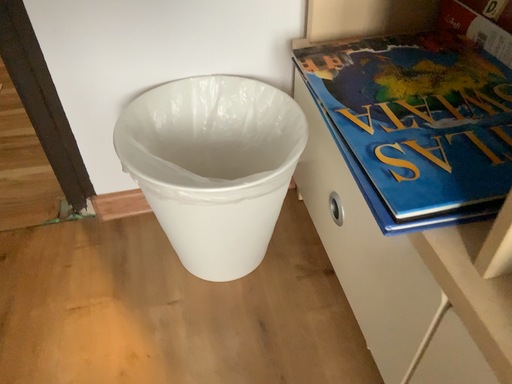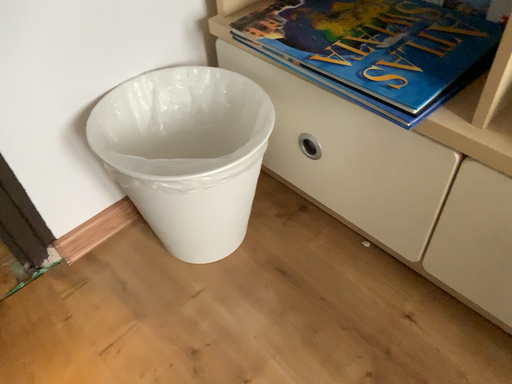
Question: Which way did the camera rotate in the video?

Choices:
 (A) rotated right
 (B) rotated left

Answer: (A)